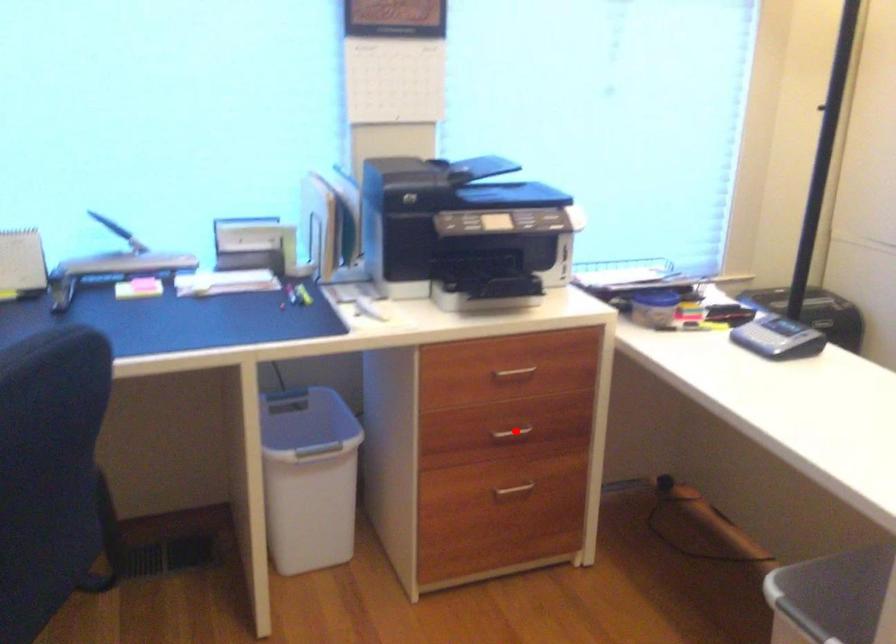
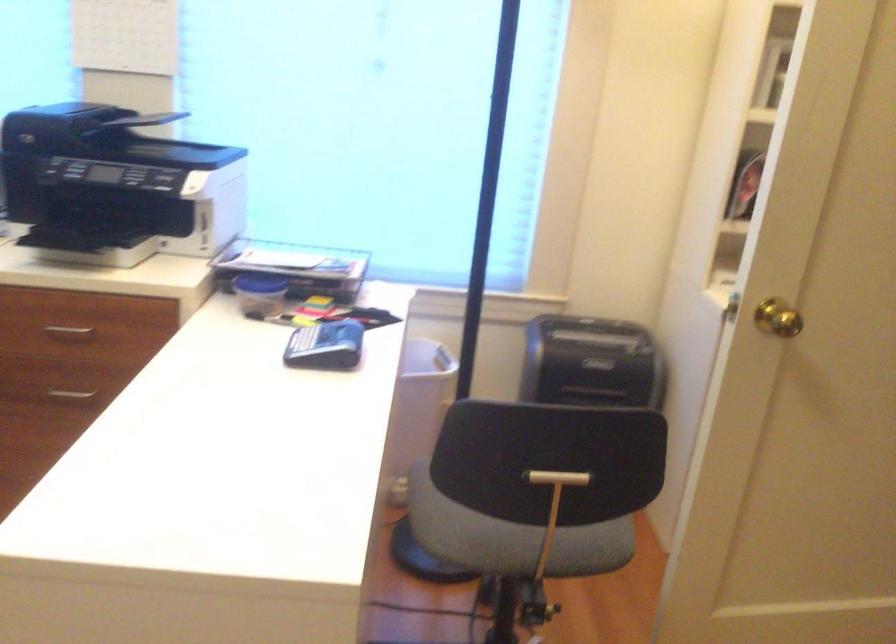
Where in the second image is the point corresponding to the highlighted location from the first image?

(71, 393)